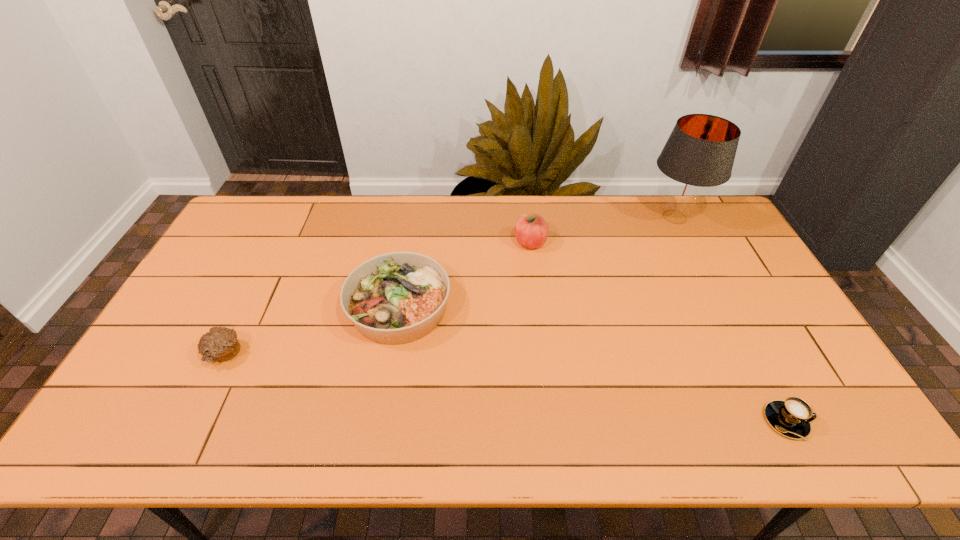
You are a GUI agent. You are given a task and a screenshot of the screen. Output one action in this format:
    pyautogui.click(x=<x>, y=<y>)
    Task: Click on the object present at the near right corner
    This screenshot has width=960, height=540.
    Given the screenshot: What is the action you would take?
    pyautogui.click(x=792, y=417)

In the image, there is a desktop. At what (x,y) coordinates should I click in order to perform the action: click on vacant space at the far edge. Please return your answer as a coordinate pair (x, y). The image size is (960, 540). Looking at the image, I should click on (500, 224).

Locate an element on the screen. blank space at the near edge of the desktop is located at coordinates (675, 413).

Locate an element on the screen. free space at the left edge is located at coordinates (140, 411).

You are a GUI agent. You are given a task and a screenshot of the screen. Output one action in this format:
    pyautogui.click(x=<x>, y=<y>)
    Task: Click on the vacant space at the right edge
    
    Given the screenshot: What is the action you would take?
    pyautogui.click(x=750, y=265)

You are a GUI agent. You are given a task and a screenshot of the screen. Output one action in this format:
    pyautogui.click(x=<x>, y=<y>)
    Task: Click on the vacant area that lies between the second tallest object and the tallest object
    
    Given the screenshot: What is the action you would take?
    pyautogui.click(x=603, y=230)

Where is `empty location between the tallest object and the shortest object`? The width and height of the screenshot is (960, 540). empty location between the tallest object and the shortest object is located at coordinates (731, 319).

Identify the location of vacant area between the shortest object and the second tallest object. (659, 332).

In order to click on vacant point located between the fourth object from right to left and the tallest object in this screenshot , I will do `click(537, 262)`.

Identify the location of free area in between the apple and the fourth object from right to left. (465, 275).